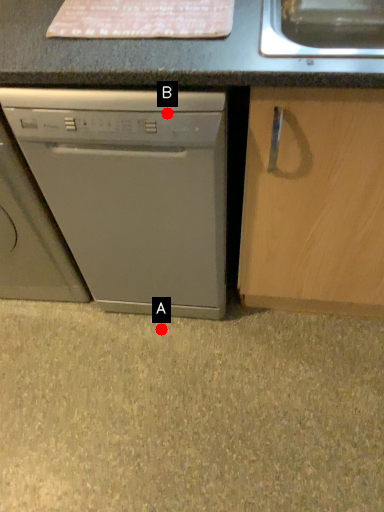
Question: Two points are circled on the image, labeled by A and B beside each circle. Which point is farther to the camera?

Choices:
 (A) A is further
 (B) B is further

Answer: (A)